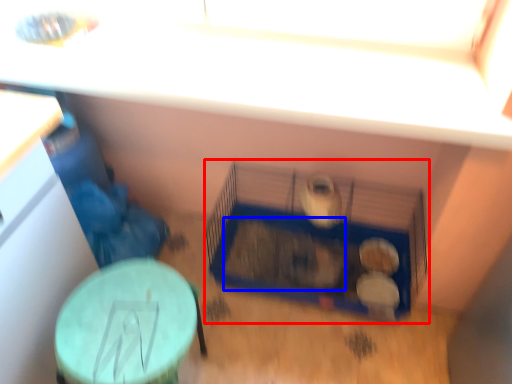
Question: Which point is further to the camera, bird cage (highlighted by a red box) or animal (highlighted by a blue box)?

Choices:
 (A) bird cage
 (B) animal

Answer: (B)